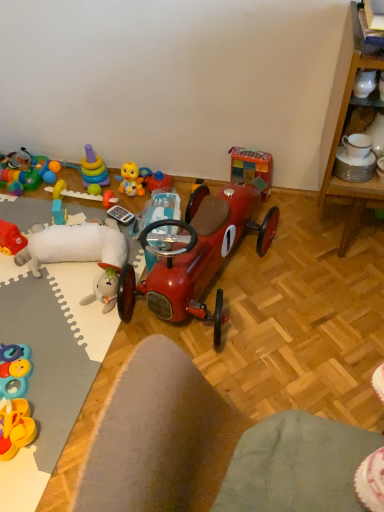
The image size is (384, 512). In order to click on vacant area that lies between rubberized plastic rings at lower left, which is the 4th toy in left-to-right order, and translucent plastic block at upper left, which is the 9th toy in right-to-left order in this screenshot , I will do `click(36, 305)`.